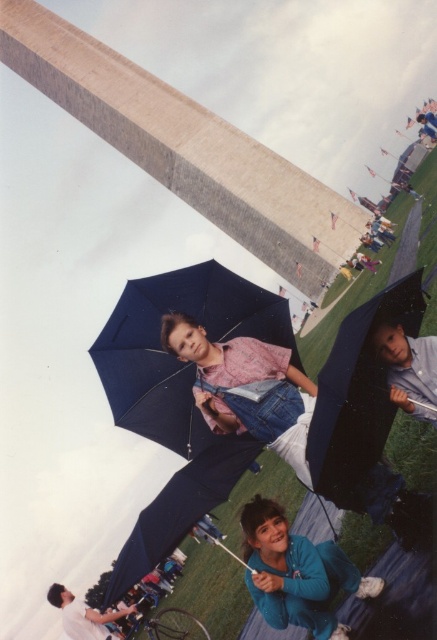
You are a photographer trying to capture a photo of the Washington Monument in the background while focusing on the two children holding umbrellas. The children are positioned such that the matte blue umbrella at center and the blue fleece jacket at lower center are part of the scene. From the perspective of the photographer, which object is located to the right side?

The blue fleece jacket at lower center is located to the right side of the matte blue umbrella at center.

You are a photographer trying to capture a photo of both the matte blue umbrella at center and the matte blue umbrella at lower right. Since you want to include both in the frame, which direction should you move your camera to ensure both are visible?

The matte blue umbrella at center is positioned on the left side of matte blue umbrella at lower right. To include both in the frame, move your camera to the left so that both umbrellas are captured within the shot.